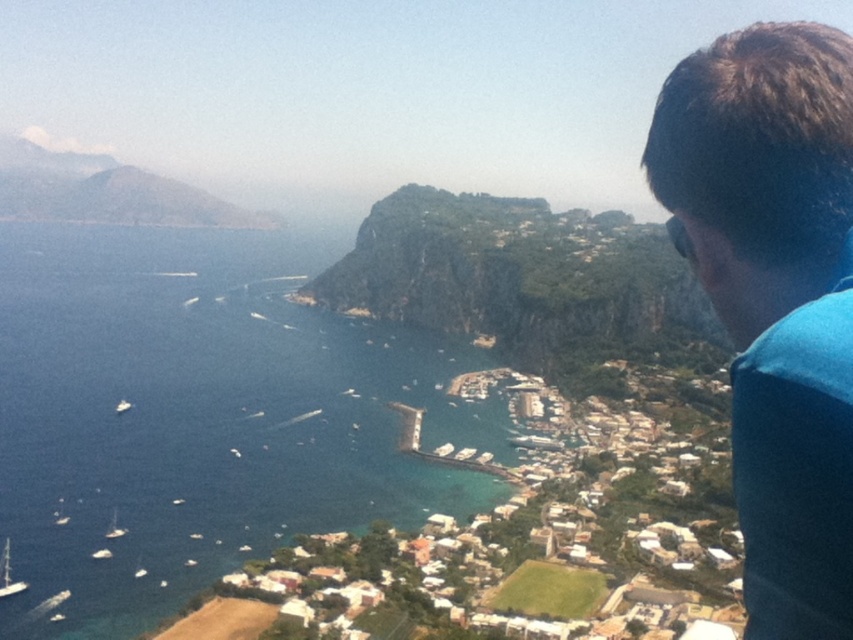
Question: Is blue water at center in front of white wooden sailboat at lower left?

Choices:
 (A) no
 (B) yes

Answer: (B)

Question: Among these points, which one is nearest to the camera?

Choices:
 (A) (251, 435)
 (B) (828, 243)
 (C) (471, 296)

Answer: (B)

Question: Which object is positioned farthest from the white matte boat at lower left?

Choices:
 (A) white wooden sailboat at lower left
 (B) green rock cliff at center

Answer: (B)

Question: Which point is farther to the camera?

Choices:
 (A) blue fabric at upper right
 (B) green rock cliff at center

Answer: (B)

Question: In this image, where is white wooden sailboat at lower left located relative to white matte boat at lower left?

Choices:
 (A) right
 (B) left

Answer: (B)

Question: Where is blue water at center located in relation to blue fabric at upper right in the image?

Choices:
 (A) below
 (B) above

Answer: (B)